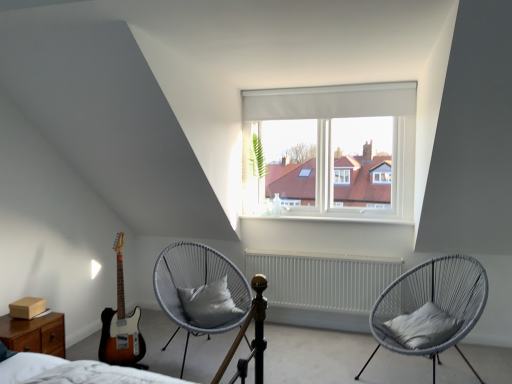
Describe the element at coordinates (430, 308) in the screenshot. I see `gray woven chair at center, the first chair when ordered from right to left` at that location.

The height and width of the screenshot is (384, 512). I want to click on gray woven chair at center, which is counted as the second chair, starting from the left, so click(x=430, y=308).

What do you see at coordinates (121, 325) in the screenshot? I see `sunburst wood guitar at left` at bounding box center [121, 325].

This screenshot has width=512, height=384. I want to click on gray woven chair with cushion at center, acting as the 1th chair starting from the left, so click(x=196, y=285).

Describe the element at coordinates (323, 279) in the screenshot. I see `white matte radiator at center` at that location.

The image size is (512, 384). Describe the element at coordinates (422, 327) in the screenshot. I see `gray fabric pillow at lower right, which is counted as the second pillow, starting from the left` at that location.

Where is `gray woven chair at center, which is counted as the second chair, starting from the left`? gray woven chair at center, which is counted as the second chair, starting from the left is located at coordinates tap(430, 308).

How different are the orientations of gray fabric pillow at center, which is the 1th pillow in back-to-front order, and gray fabric pillow at lower right, which is counted as the 2th pillow, starting from the back, in degrees?

They differ by 98.3 degrees in their facing directions.

Locate an element on the screen. This screenshot has height=384, width=512. pillow in front of the gray fabric pillow at center, positioned as the second pillow in front-to-back order is located at coordinates (422, 327).

Which object is positioned more to the left, gray fabric pillow at center, marked as the 2th pillow in a right-to-left arrangement, or gray fabric pillow at lower right, which is counted as the second pillow, starting from the left?

Positioned to the left is gray fabric pillow at center, marked as the 2th pillow in a right-to-left arrangement.

Is gray fabric pillow at lower right, acting as the first pillow starting from the right, located within gray fabric pillow at center, positioned as the second pillow in front-to-back order?

Actually, gray fabric pillow at lower right, acting as the first pillow starting from the right, is outside gray fabric pillow at center, positioned as the second pillow in front-to-back order.

Is the depth of gray fabric pillow at center, which is the 1th pillow from left to right, less than that of brown wood nightstand at lower left?

No, gray fabric pillow at center, which is the 1th pillow from left to right, is behind brown wood nightstand at lower left.

Is brown wood nightstand at lower left at the back of gray fabric pillow at center, which is the 1th pillow in back-to-front order?

No.

How many degrees apart are the facing directions of gray fabric pillow at center, positioned as the second pillow in front-to-back order, and brown wood nightstand at lower left?

The angle between the facing direction of gray fabric pillow at center, positioned as the second pillow in front-to-back order, and the facing direction of brown wood nightstand at lower left is 51.8 degrees.

At what (x,y) coordinates should I click in order to perform the action: click on the 1st pillow behind the brown wood nightstand at lower left. Please return your answer as a coordinate pair (x, y). The height and width of the screenshot is (384, 512). Looking at the image, I should click on (422, 327).

From a real-world perspective, who is located higher, gray fabric pillow at lower right, which is counted as the 2th pillow, starting from the back, or brown wood nightstand at lower left?

gray fabric pillow at lower right, which is counted as the 2th pillow, starting from the back, from a real-world perspective.

Does gray fabric pillow at lower right, which is counted as the first pillow, starting from the front, have a lesser height compared to brown wood nightstand at lower left?

Correct, gray fabric pillow at lower right, which is counted as the first pillow, starting from the front, is not as tall as brown wood nightstand at lower left.

From a real-world perspective, is gray fabric pillow at center, which is the 1th pillow from left to right, located beneath white matte radiator at center?

No.

From the image's perspective, is gray fabric pillow at center, marked as the 2th pillow in a right-to-left arrangement, positioned above or below white matte radiator at center?

From the image's perspective, gray fabric pillow at center, marked as the 2th pillow in a right-to-left arrangement, appears above white matte radiator at center.

Which is behind, point (225, 279) or point (358, 284)?

Point (358, 284)

Can you see gray fabric pillow at center, which is the 1th pillow in back-to-front order, touching white matte radiator at center?

No, gray fabric pillow at center, which is the 1th pillow in back-to-front order, is not in contact with white matte radiator at center.

Could you tell me if sunburst wood guitar at left is facing gray woven chair with cushion at center, the 2th chair when ordered from right to left?

No.

Which object is wider, sunburst wood guitar at left or gray woven chair with cushion at center, the 2th chair when ordered from right to left?

With larger width is gray woven chair with cushion at center, the 2th chair when ordered from right to left.

Based on the photo, who is smaller, sunburst wood guitar at left or gray woven chair with cushion at center, acting as the 1th chair starting from the left?

Smaller between the two is sunburst wood guitar at left.

Considering the sizes of objects sunburst wood guitar at left and gray woven chair with cushion at center, acting as the 1th chair starting from the left, in the image provided, who is shorter, sunburst wood guitar at left or gray woven chair with cushion at center, acting as the 1th chair starting from the left,?

gray woven chair with cushion at center, acting as the 1th chair starting from the left, is shorter.

Which is correct: gray woven chair with cushion at center, acting as the 1th chair starting from the left, is inside sunburst wood guitar at left, or outside of it?

gray woven chair with cushion at center, acting as the 1th chair starting from the left, is not inside sunburst wood guitar at left, it's outside.

Who is shorter, gray woven chair with cushion at center, the 2th chair when ordered from right to left, or sunburst wood guitar at left?

gray woven chair with cushion at center, the 2th chair when ordered from right to left.

Which is behind, point (183, 282) or point (145, 351)?

The point (183, 282) is more distant.

Is gray woven chair with cushion at center, acting as the 1th chair starting from the left, directly adjacent to sunburst wood guitar at left?

There is a gap between gray woven chair with cushion at center, acting as the 1th chair starting from the left, and sunburst wood guitar at left.

Where is `the 1st pillow positioned above the gray woven chair at center, which is counted as the second chair, starting from the left (from the image's perspective)`? This screenshot has height=384, width=512. the 1st pillow positioned above the gray woven chair at center, which is counted as the second chair, starting from the left (from the image's perspective) is located at coordinates (422, 327).

Is gray fabric pillow at lower right, acting as the first pillow starting from the right, spatially inside gray woven chair at center, the first chair when ordered from right to left, or outside of it?

gray fabric pillow at lower right, acting as the first pillow starting from the right, is spatially positioned inside gray woven chair at center, the first chair when ordered from right to left.

Considering the sizes of objects gray fabric pillow at lower right, acting as the first pillow starting from the right, and gray woven chair at center, the first chair when ordered from right to left, in the image provided, who is taller, gray fabric pillow at lower right, acting as the first pillow starting from the right, or gray woven chair at center, the first chair when ordered from right to left,?

With more height is gray woven chair at center, the first chair when ordered from right to left.

Considering the sizes of objects gray fabric pillow at lower right, which is counted as the 2th pillow, starting from the back, and gray woven chair at center, the first chair when ordered from right to left, in the image provided, who is bigger, gray fabric pillow at lower right, which is counted as the 2th pillow, starting from the back, or gray woven chair at center, the first chair when ordered from right to left,?

Bigger between the two is gray woven chair at center, the first chair when ordered from right to left.

What are the coordinates of `pillow above the gray fabric pillow at lower right, which is counted as the 2th pillow, starting from the back (from the image's perspective)` in the screenshot? It's located at (209, 304).

From a real-world perspective, which pillow is the 2nd one above the brown wood nightstand at lower left? Please provide its 2D coordinates.

[(209, 304)]

Estimate the real-world distances between objects in this image. Which object is further from gray woven chair with cushion at center, the 2th chair when ordered from right to left, gray fabric pillow at center, positioned as the second pillow in front-to-back order, or gray woven chair at center, the first chair when ordered from right to left?

gray woven chair at center, the first chair when ordered from right to left, is further to gray woven chair with cushion at center, the 2th chair when ordered from right to left.

Looking at the image, which one is located closer to gray woven chair with cushion at center, the 2th chair when ordered from right to left, white matte radiator at center or gray fabric pillow at center, which is the 1th pillow in back-to-front order?

The object closer to gray woven chair with cushion at center, the 2th chair when ordered from right to left, is gray fabric pillow at center, which is the 1th pillow in back-to-front order.

Looking at the image, which one is located closer to gray fabric pillow at center, positioned as the second pillow in front-to-back order, gray fabric pillow at lower right, which is counted as the second pillow, starting from the left, or gray woven chair with cushion at center, the 2th chair when ordered from right to left?

gray woven chair with cushion at center, the 2th chair when ordered from right to left, lies closer to gray fabric pillow at center, positioned as the second pillow in front-to-back order, than the other object.

Considering their positions, is brown wood nightstand at lower left positioned further to gray fabric pillow at center, which is the 1th pillow in back-to-front order, than gray woven chair at center, which is counted as the second chair, starting from the left?

The object further to gray fabric pillow at center, which is the 1th pillow in back-to-front order, is gray woven chair at center, which is counted as the second chair, starting from the left.

From the image, which object appears to be farther from gray woven chair with cushion at center, acting as the 1th chair starting from the left, sunburst wood guitar at left or gray fabric pillow at center, which is the 1th pillow from left to right?

sunburst wood guitar at left lies further to gray woven chair with cushion at center, acting as the 1th chair starting from the left, than the other object.

Looking at this image, from the image, which object appears to be nearer to gray woven chair with cushion at center, acting as the 1th chair starting from the left, gray fabric pillow at center, which is the 1th pillow in back-to-front order, or gray fabric pillow at lower right, which is counted as the first pillow, starting from the front?

gray fabric pillow at center, which is the 1th pillow in back-to-front order, is positioned closer to the anchor gray woven chair with cushion at center, acting as the 1th chair starting from the left.

When comparing their distances from gray woven chair at center, the first chair when ordered from right to left, does gray fabric pillow at center, positioned as the second pillow in front-to-back order, or white matte radiator at center seem further?

The object further to gray woven chair at center, the first chair when ordered from right to left, is gray fabric pillow at center, positioned as the second pillow in front-to-back order.

When comparing their distances from sunburst wood guitar at left, does white matte radiator at center or gray woven chair at center, which is counted as the second chair, starting from the left, seem further?

gray woven chair at center, which is counted as the second chair, starting from the left, lies further to sunburst wood guitar at left than the other object.

The width and height of the screenshot is (512, 384). Find the location of `chair between sunburst wood guitar at left and white matte radiator at center`. chair between sunburst wood guitar at left and white matte radiator at center is located at coordinates (196, 285).

Find the location of a particular element. chair located between sunburst wood guitar at left and gray woven chair at center, the first chair when ordered from right to left, in the left-right direction is located at coordinates (196, 285).

Find the location of a particular element. pillow between brown wood nightstand at lower left and gray fabric pillow at lower right, which is counted as the first pillow, starting from the front, in the horizontal direction is located at coordinates (209, 304).

At what (x,y) coordinates should I click in order to perform the action: click on radiator situated between gray woven chair with cushion at center, acting as the 1th chair starting from the left, and gray woven chair at center, which is counted as the second chair, starting from the left, from left to right. Please return your answer as a coordinate pair (x, y). Image resolution: width=512 pixels, height=384 pixels. Looking at the image, I should click on (323, 279).